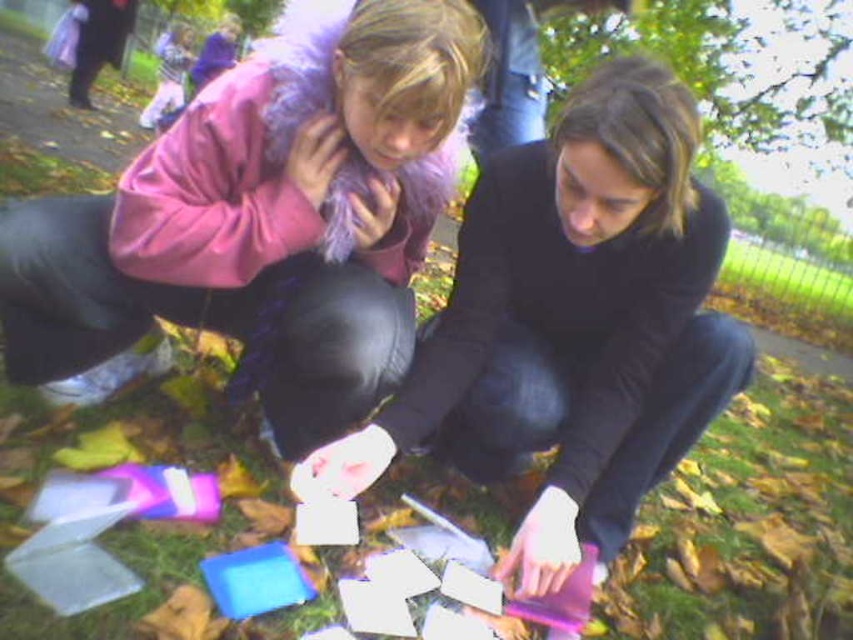
You are a photographer trying to capture a closeup of the purple glossy phone at lower center without including the pink fur coat at upper left in the frame. Based on their positions, is this possible?

The pink fur coat at upper left is located above the purple glossy phone at lower center, so it might be challenging to capture the purple glossy phone at lower center without including the pink fur coat at upper left in the frame.

You are a photographer trying to capture a closeup of the purple glossy phone at lower center without including the pink fur coat at upper left in the frame. Given their sizes, is this possible?

The pink fur coat at upper left is bigger than the purple glossy phone at lower center, so it might be challenging to exclude the pink fur coat at upper left from the frame if the phone is at the lower center and the coat is at the upper left, depending on the camera angle and zoom.

You are trying to reach the purple glossy phone at lower center to answer an urgent call. However, the matte black jacket at center is blocking your path. Can you move the jacket to access the phone?

The matte black jacket at center is positioned over purple glossy phone at lower center, so you need to move the jacket to access the phone.